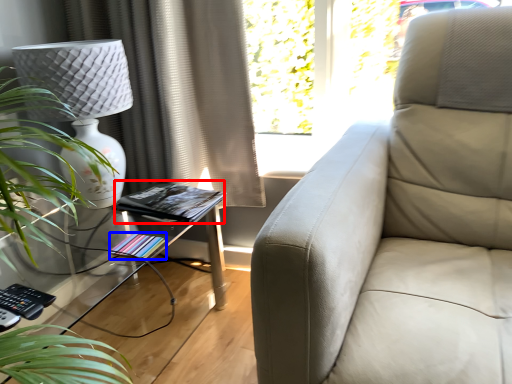
Question: Which object appears closest to the camera in this image, book (highlighted by a red box) or book (highlighted by a blue box)?

Choices:
 (A) book
 (B) book

Answer: (B)